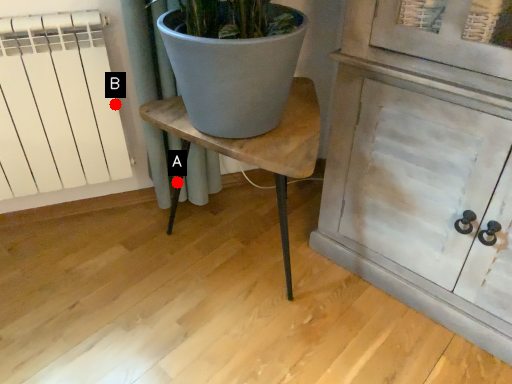
Question: Two points are circled on the image, labeled by A and B beside each circle. Which point appears farthest from the camera in this image?

Choices:
 (A) A is further
 (B) B is further

Answer: (A)